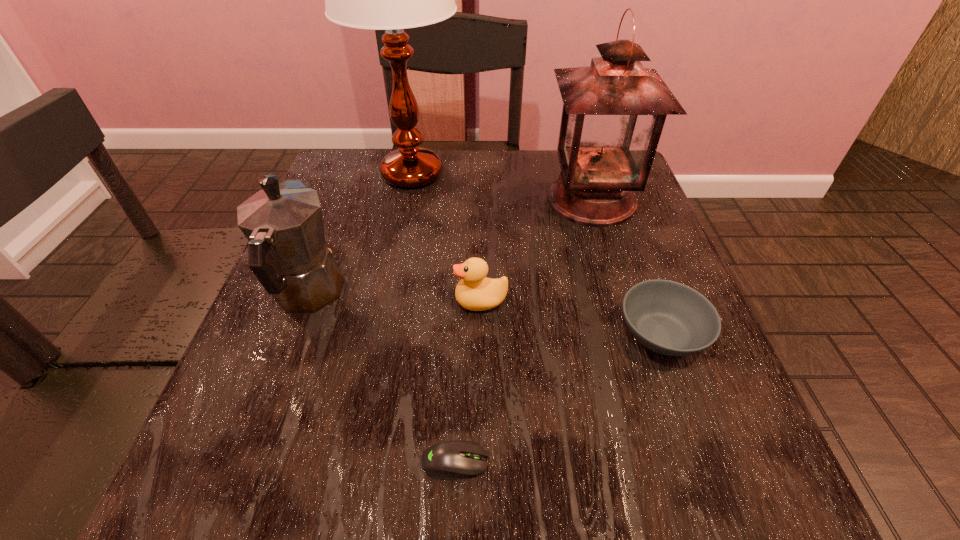
This screenshot has width=960, height=540. I want to click on table lamp present at the left edge, so click(x=392, y=0).

Find the location of a particular element. coffeepot that is at the left edge is located at coordinates (283, 223).

In order to click on oil lamp present at the right edge in this screenshot , I will do click(x=614, y=111).

Image resolution: width=960 pixels, height=540 pixels. What are the coordinates of `soup bowl located in the right edge section of the desktop` in the screenshot? It's located at (669, 318).

Find the location of a particular element. object located at the far left corner is located at coordinates (392, 0).

This screenshot has width=960, height=540. Find the location of `object situated at the far right corner`. object situated at the far right corner is located at coordinates (614, 111).

In the image, there is a desktop. At what (x,y) coordinates should I click in order to perform the action: click on free space at the far edge. Please return your answer as a coordinate pair (x, y). The width and height of the screenshot is (960, 540). Looking at the image, I should click on (480, 187).

The width and height of the screenshot is (960, 540). Find the location of `free space at the right edge of the desktop`. free space at the right edge of the desktop is located at coordinates (595, 271).

This screenshot has height=540, width=960. I want to click on vacant space at the far left corner of the desktop, so click(381, 201).

Where is `vacant space at the near left corner of the desktop`? This screenshot has height=540, width=960. vacant space at the near left corner of the desktop is located at coordinates (240, 516).